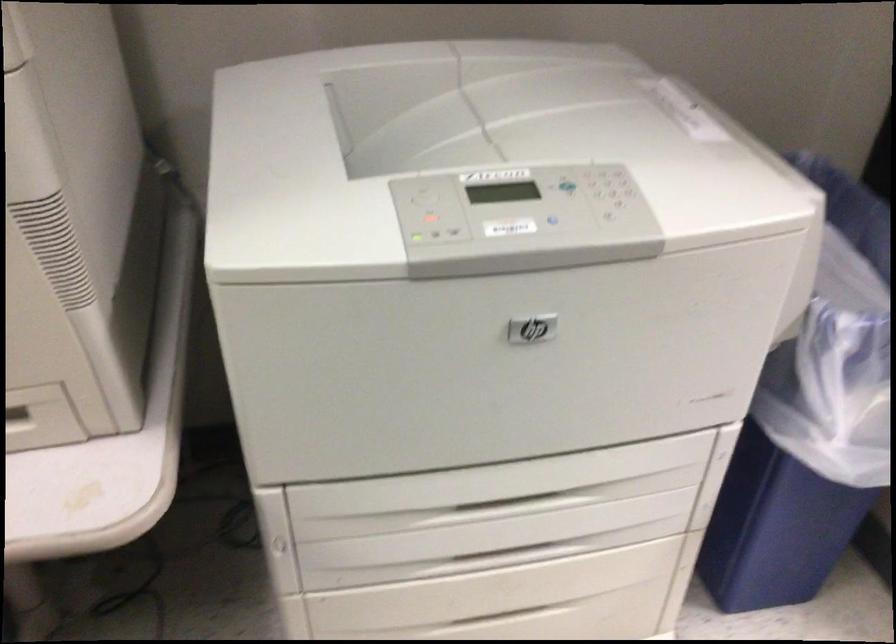
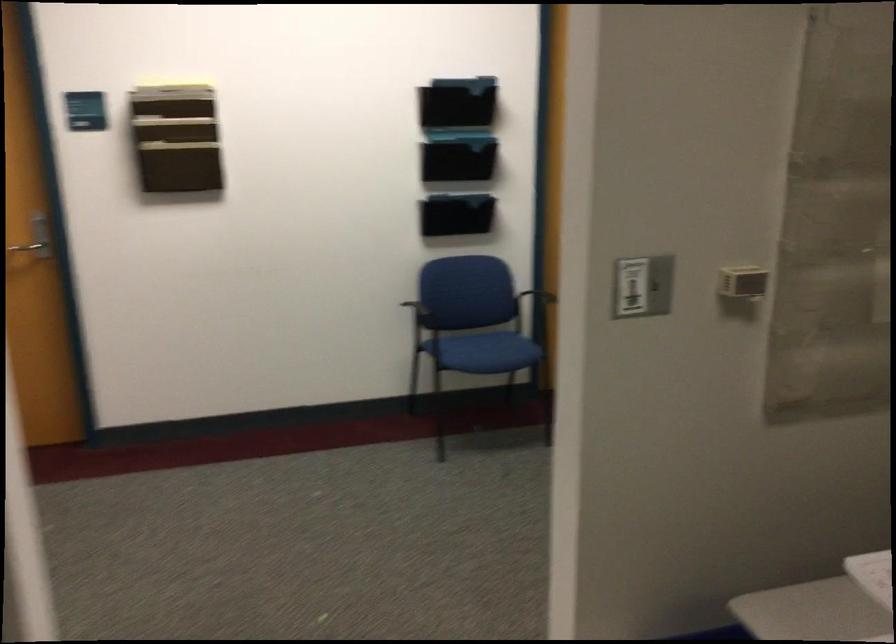
Question: How did the camera likely rotate?

Choices:
 (A) Left
 (B) Right
 (C) Up
 (D) Down

Answer: (B)